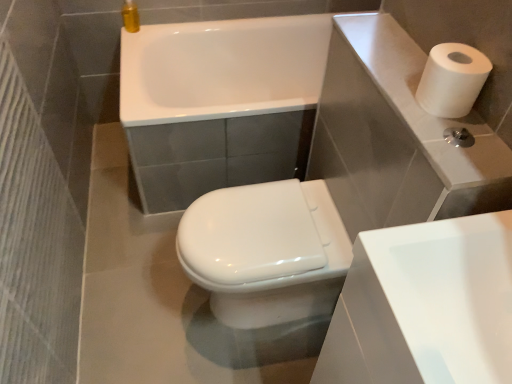
This screenshot has height=384, width=512. In order to click on white glossy sink at lower right in this screenshot , I will do `click(425, 306)`.

What do you see at coordinates (265, 251) in the screenshot? This screenshot has height=384, width=512. I see `white glossy bidet at center` at bounding box center [265, 251].

The width and height of the screenshot is (512, 384). In order to click on white matte paper towel at upper right in this screenshot , I will do `click(452, 80)`.

Looking at this image, from a real-world perspective, is white glossy bidet at center positioned over white matte paper towel at upper right based on gravity?

No, from a real-world perspective, white glossy bidet at center is not over white matte paper towel at upper right

Considering the sizes of objects white glossy bidet at center and white matte paper towel at upper right in the image provided, who is shorter, white glossy bidet at center or white matte paper towel at upper right?

white matte paper towel at upper right.

Is point (347, 268) less distant than point (445, 113)?

That is False.

Locate an element on the screen. The height and width of the screenshot is (384, 512). paper towel that appears above the white glossy bidet at center (from the image's perspective) is located at coordinates point(452,80).

Could white glossy bathtub at upper center be considered to be inside white matte paper towel at upper right?

No, white matte paper towel at upper right does not contain white glossy bathtub at upper center.

Considering the sizes of white matte paper towel at upper right and white glossy bathtub at upper center in the image, is white matte paper towel at upper right bigger or smaller than white glossy bathtub at upper center?

In the image, white matte paper towel at upper right appears to be smaller than white glossy bathtub at upper center.

I want to click on bath lying above the white matte paper towel at upper right (from the image's perspective), so click(x=220, y=103).

Considering the sizes of objects white glossy sink at lower right and white glossy bathtub at upper center in the image provided, who is wider, white glossy sink at lower right or white glossy bathtub at upper center?

With larger width is white glossy bathtub at upper center.

Between white glossy sink at lower right and white glossy bathtub at upper center, which one has more height?

Standing taller between the two is white glossy sink at lower right.

How different are the orientations of white glossy sink at lower right and white glossy bathtub at upper center in degrees?

→ The angle between the facing direction of white glossy sink at lower right and the facing direction of white glossy bathtub at upper center is 1.07 degrees.

From the picture: Between white glossy sink at lower right and white glossy bathtub at upper center, which one is positioned in front?

white glossy sink at lower right is more forward.

Is white glossy bathtub at upper center in contact with white matte paper towel at upper right?

No.

Considering the relative sizes of white glossy bathtub at upper center and white matte paper towel at upper right in the image provided, is white glossy bathtub at upper center smaller than white matte paper towel at upper right?

Incorrect, white glossy bathtub at upper center is not smaller in size than white matte paper towel at upper right.

Is white glossy bathtub at upper center in front of or behind white matte paper towel at upper right in the image?

white glossy bathtub at upper center is positioned farther from the viewer than white matte paper towel at upper right.

Between point (271, 269) and point (376, 235), which one is positioned behind?

Positioned behind is point (271, 269).

Which object is closer to the camera taking this photo, white glossy bidet at center or white glossy sink at lower right?

white glossy sink at lower right is in front.

The width and height of the screenshot is (512, 384). In order to click on bidet beneath the white glossy sink at lower right (from a real-world perspective) in this screenshot , I will do `click(265, 251)`.

How far apart are white glossy bidet at center and white glossy sink at lower right?

white glossy bidet at center is 47.26 centimeters from white glossy sink at lower right.

From the image's perspective, relative to white matte paper towel at upper right, is white glossy sink at lower right above or below?

Clearly, from the image's perspective, white glossy sink at lower right is below white matte paper towel at upper right.

From the picture: Is white glossy sink at lower right wider than white matte paper towel at upper right?

Yes.

Find the location of a particular element. paper towel that appears behind the white glossy sink at lower right is located at coordinates (452, 80).

From a real-world perspective, is white glossy bidet at center physically below white glossy bathtub at upper center?

Yes, from a real-world perspective, white glossy bidet at center is beneath white glossy bathtub at upper center.

Identify the location of bidet on the left of white glossy bathtub at upper center. The width and height of the screenshot is (512, 384). [x=265, y=251].

Between point (251, 252) and point (240, 99), which one is positioned behind?

Point (240, 99)

I want to click on paper towel on the right of white glossy bidet at center, so click(x=452, y=80).

Where is `bath on the left of white matte paper towel at upper right`? This screenshot has width=512, height=384. bath on the left of white matte paper towel at upper right is located at coordinates (220, 103).

From the image, which object appears to be farther from white glossy sink at lower right, white glossy bidet at center or white matte paper towel at upper right?

white glossy bidet at center is further to white glossy sink at lower right.

Looking at the image, which one is located closer to white matte paper towel at upper right, white glossy sink at lower right or white glossy bathtub at upper center?

white glossy sink at lower right lies closer to white matte paper towel at upper right than the other object.

From the image, which object appears to be nearer to white matte paper towel at upper right, white glossy bidet at center or white glossy sink at lower right?

The object closer to white matte paper towel at upper right is white glossy sink at lower right.

From the picture: When comparing their distances from white glossy bidet at center, does white glossy bathtub at upper center or white glossy sink at lower right seem closer?

white glossy sink at lower right lies closer to white glossy bidet at center than the other object.

Considering their positions, is white glossy sink at lower right positioned closer to white glossy bidet at center than white glossy bathtub at upper center?

white glossy sink at lower right is positioned closer to the anchor white glossy bidet at center.

Consider the image. Considering their positions, is white glossy bathtub at upper center positioned closer to white glossy sink at lower right than white glossy bidet at center?

white glossy bidet at center is positioned closer to the anchor white glossy sink at lower right.

Based on their spatial positions, is white glossy bidet at center or white matte paper towel at upper right further from white glossy bathtub at upper center?

white matte paper towel at upper right.

From the image, which object appears to be farther from white matte paper towel at upper right, white glossy bathtub at upper center or white glossy sink at lower right?

white glossy bathtub at upper center lies further to white matte paper towel at upper right than the other object.

This screenshot has height=384, width=512. I want to click on bidet between white glossy bathtub at upper center and white glossy sink at lower right vertically, so click(x=265, y=251).

Identify the location of bidet between white matte paper towel at upper right and white glossy sink at lower right vertically. (x=265, y=251).

Locate an element on the screen. Image resolution: width=512 pixels, height=384 pixels. bidet located between white matte paper towel at upper right and white glossy bathtub at upper center in the depth direction is located at coordinates (265, 251).

I want to click on paper towel between white glossy bathtub at upper center and white glossy sink at lower right in the up-down direction, so [x=452, y=80].